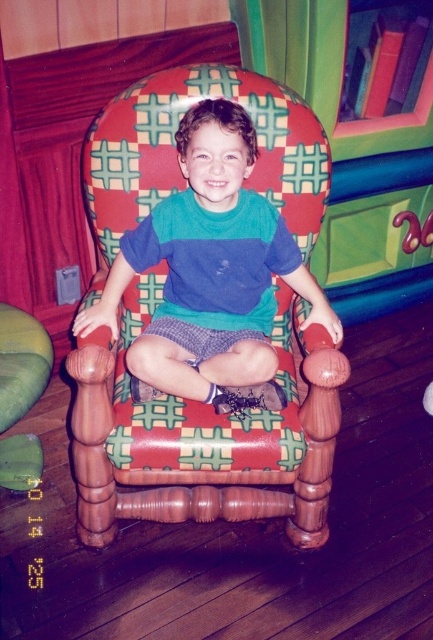
Which is in front, point (235, 282) or point (0, 376)?

Point (0, 376) is in front.

Between matte green shirt at center and green fabric rocking chair at lower left, which one appears on the left side from the viewer's perspective?

From the viewer's perspective, green fabric rocking chair at lower left appears more on the left side.

Which is behind, point (202, 368) or point (3, 460)?

The point (3, 460) is behind.

Where is `matte green shirt at center`? matte green shirt at center is located at coordinates (210, 268).